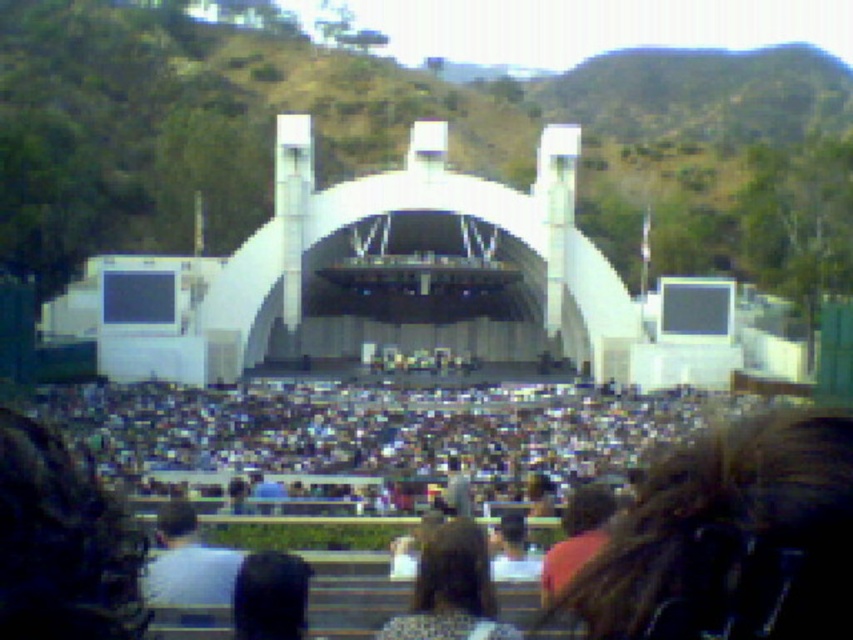
Does dark gray crowd at center appear over black fabric at center?

Indeed, dark gray crowd at center is positioned over black fabric at center.

Is dark gray crowd at center wider than black fabric at center?

Correct, the width of dark gray crowd at center exceeds that of black fabric at center.

Which is behind, point (73, 424) or point (248, 586)?

Positioned behind is point (73, 424).

Locate an element on the screen. This screenshot has height=640, width=853. dark gray crowd at center is located at coordinates (376, 429).

Does dark gray crowd at center lie behind dark brown hair at center?

Yes, it is.

Between dark gray crowd at center and dark brown hair at center, which one appears on the right side from the viewer's perspective?

dark brown hair at center is more to the right.

The height and width of the screenshot is (640, 853). Describe the element at coordinates (376, 429) in the screenshot. I see `dark gray crowd at center` at that location.

The image size is (853, 640). In order to click on dark gray crowd at center in this screenshot , I will do `click(376, 429)`.

Is dark brown hair at center wider than black fabric at center?

Yes, dark brown hair at center is wider than black fabric at center.

Describe the element at coordinates (451, 589) in the screenshot. I see `dark brown hair at center` at that location.

Image resolution: width=853 pixels, height=640 pixels. What are the coordinates of `dark brown hair at center` in the screenshot? It's located at (451, 589).

This screenshot has height=640, width=853. Identify the location of dark brown hair at center. (451, 589).